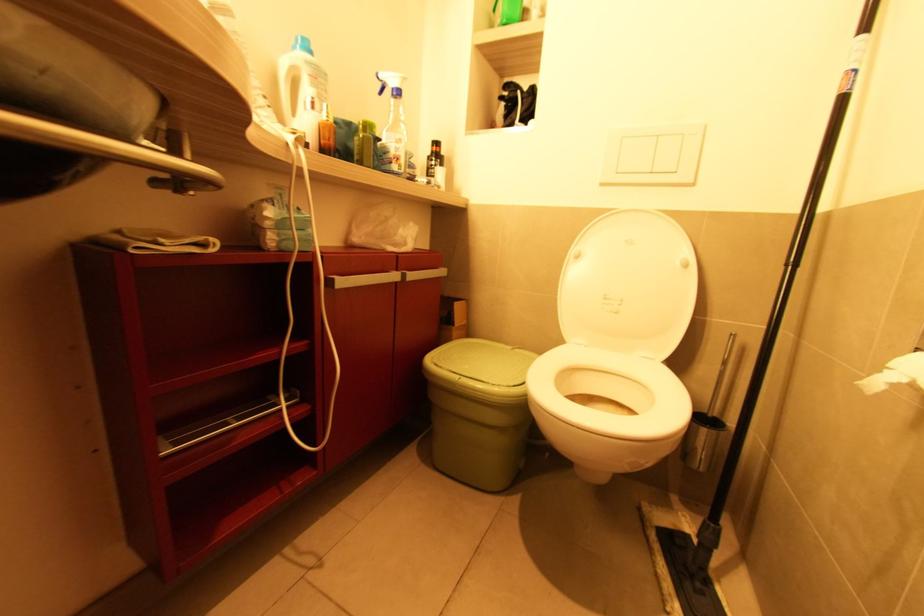
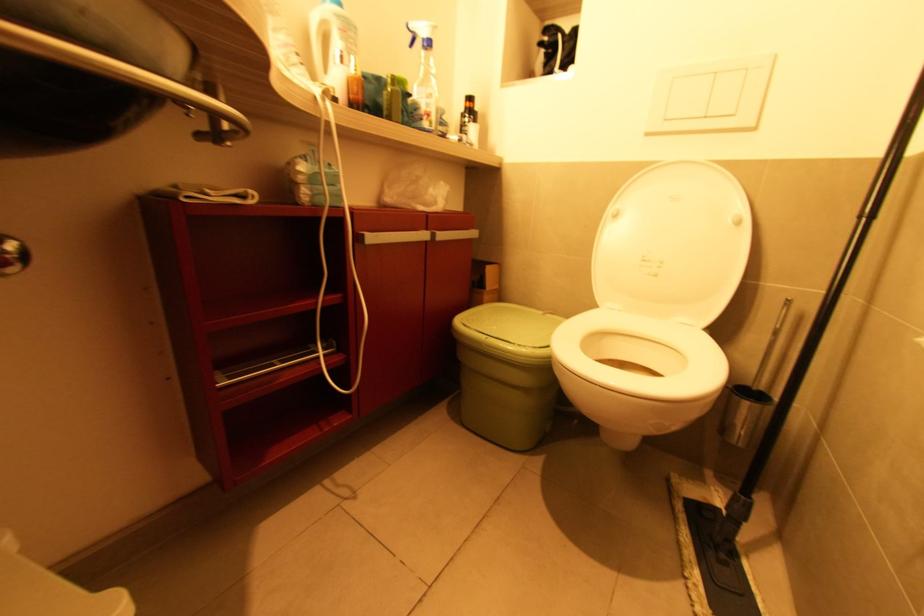
Where in the second image is the point corresponding to pixel 515 349 from the first image?

(545, 314)